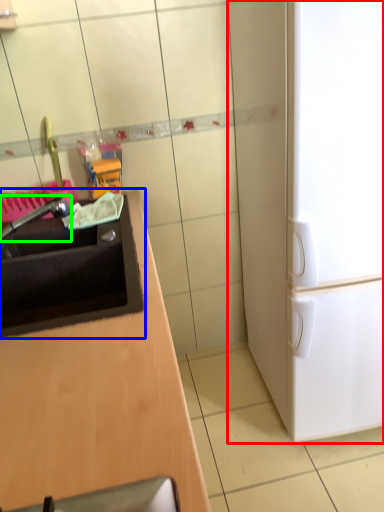
Question: Based on their relative distances, which object is nearer to refrigerator (highlighted by a red box)? Choose from sink (highlighted by a blue box) and faucet (highlighted by a green box).

Choices:
 (A) sink
 (B) faucet

Answer: (A)